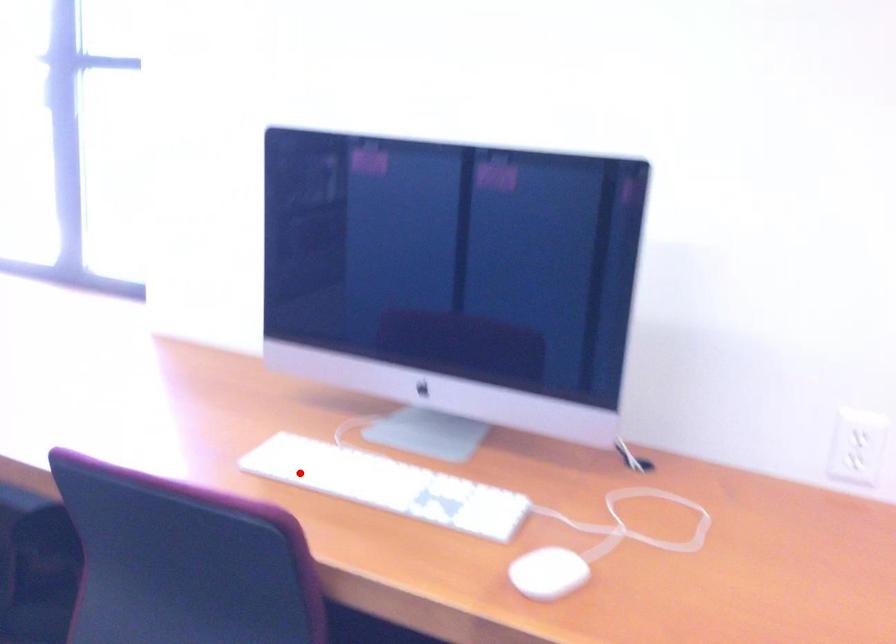
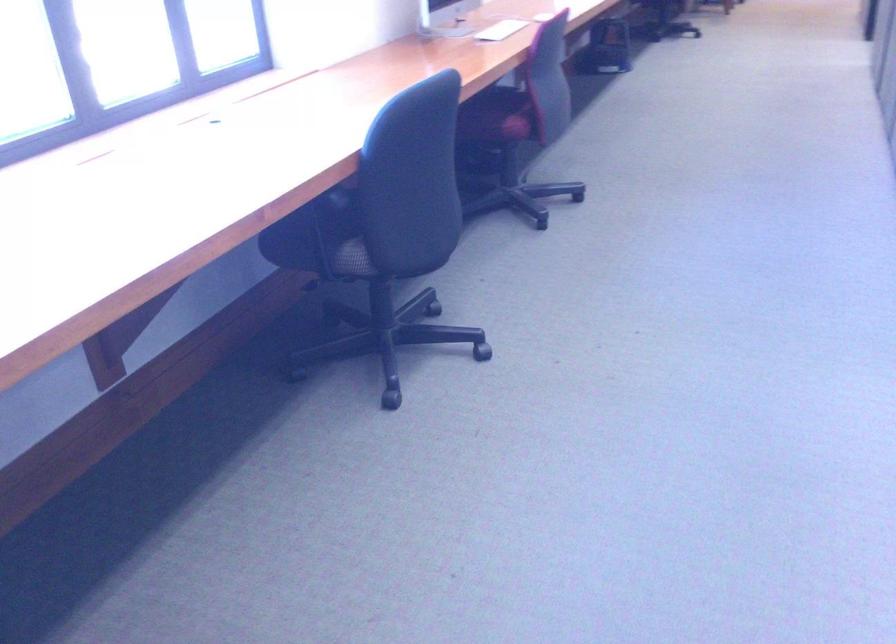
Locate, in the second image, the point that corresponds to the highlighted location in the first image.

(501, 30)